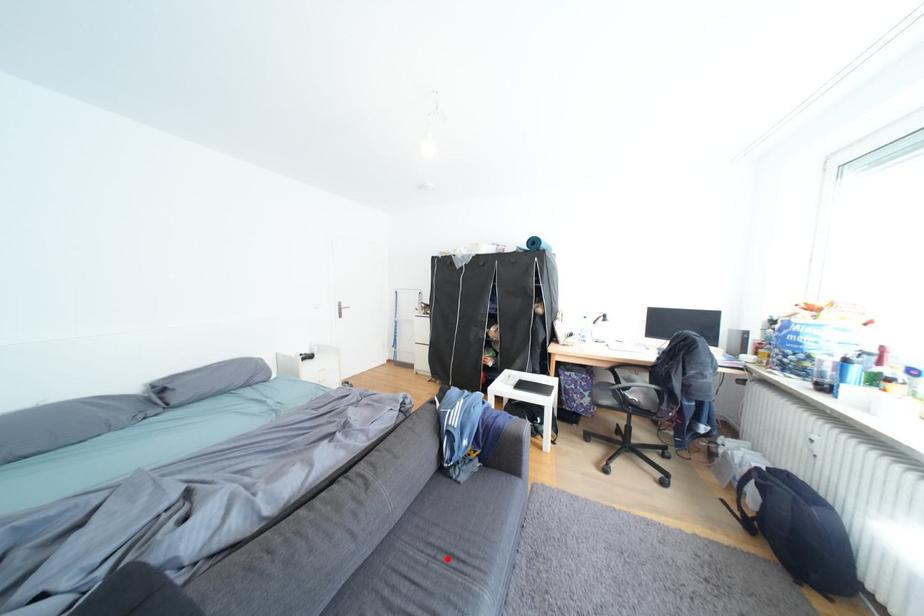
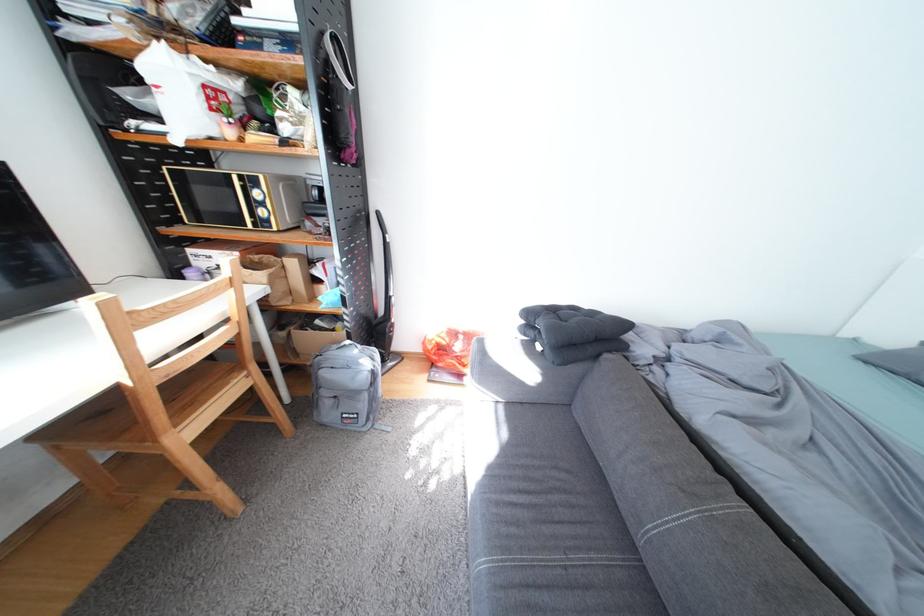
Locate, in the second image, the point that corresponds to the highlighted location in the first image.

(578, 569)